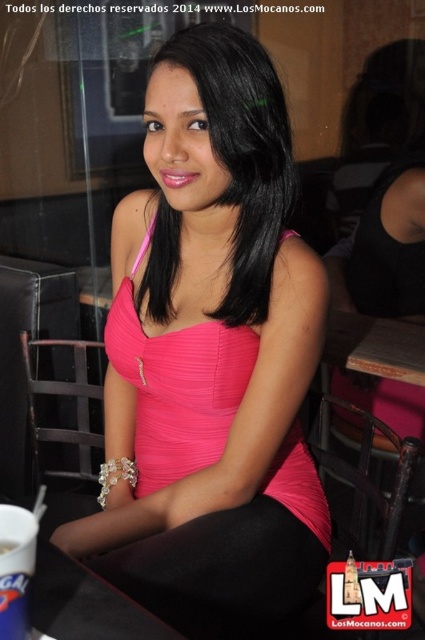
Question: Which point is closer to the camera?

Choices:
 (A) matte pink dress at center
 (B) white plastic cup at lower left
 (C) pink satin dress at center

Answer: (B)

Question: Which of these objects is positioned farthest from the black leather table at lower left?

Choices:
 (A) pink satin blouse at center
 (B) pink satin dress at center
 (C) white plastic cup at lower left

Answer: (A)

Question: Can you confirm if black leather table at lower left is positioned to the left of white plastic cup at lower left?

Choices:
 (A) no
 (B) yes

Answer: (A)

Question: Does pink satin blouse at center have a lesser width compared to black leather table at lower left?

Choices:
 (A) yes
 (B) no

Answer: (B)

Question: Is pink satin blouse at center above black leather table at lower left?

Choices:
 (A) no
 (B) yes

Answer: (B)

Question: Which point is closer to the camera?

Choices:
 (A) black leather table at lower left
 (B) pink satin blouse at center
 (C) white plastic cup at lower left
 (D) pink satin dress at center

Answer: (C)